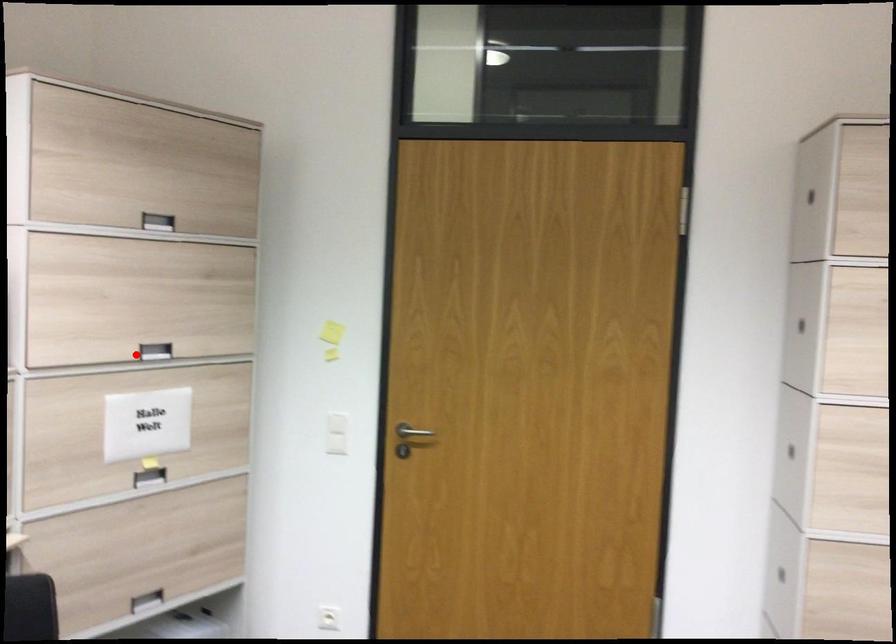
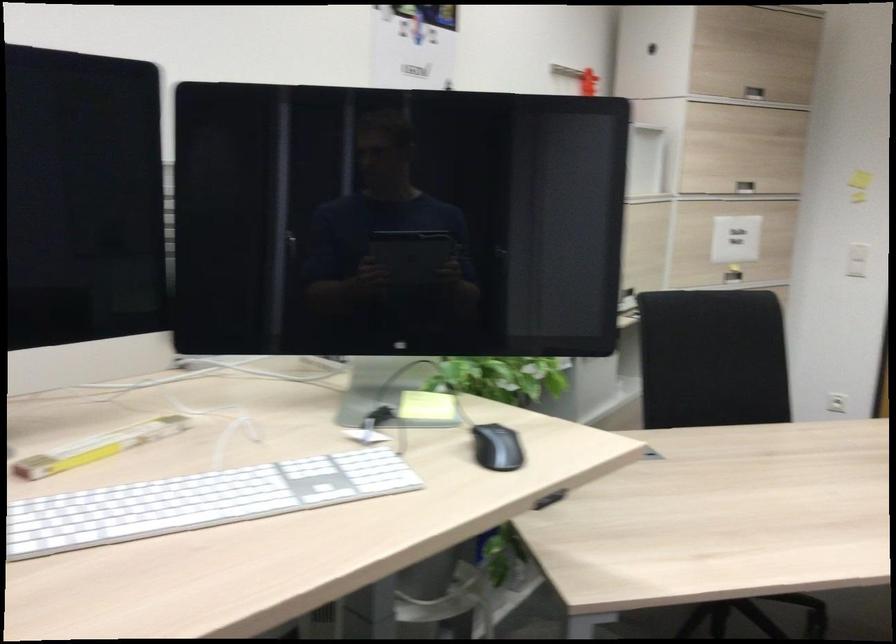
Question: I am providing you with two images of the same scene from different viewpoints. Image1 has a red point marked. In image2, the corresponding 3D location appears at what relative position? Reply with the corresponding letter.

Choices:
 (A) Closer
 (B) Farther

Answer: (B)